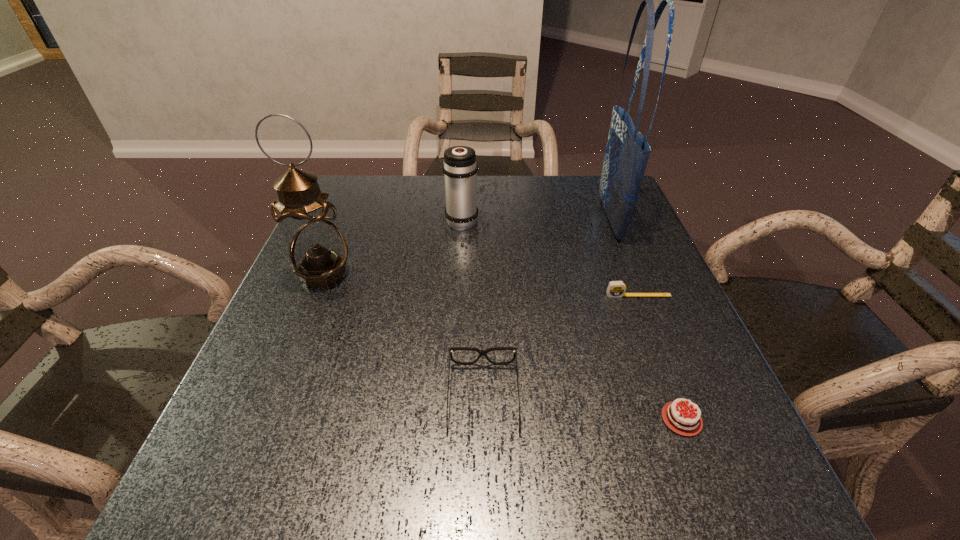
The image size is (960, 540). Identify the location of free space located on the front of the leftmost object. (307, 316).

This screenshot has width=960, height=540. In order to click on blank space located on the side with the handle of the fourth shortest object in this screenshot , I will do `click(465, 179)`.

Find the location of `vacant point located on the side with the handle of the fourth shortest object`. vacant point located on the side with the handle of the fourth shortest object is located at coordinates (464, 194).

Locate an element on the screen. This screenshot has height=540, width=960. free space located at the front of the tape measure with the tape extended is located at coordinates (699, 450).

This screenshot has height=540, width=960. Find the location of `free point located on the back of the chocolate cake`. free point located on the back of the chocolate cake is located at coordinates (630, 282).

Find the location of a particular element. shopping bag at the far edge is located at coordinates (627, 151).

Locate an element on the screen. thermos bottle that is at the far edge is located at coordinates (460, 169).

The height and width of the screenshot is (540, 960). What are the coordinates of `object positioned at the near edge` in the screenshot? It's located at (687, 422).

This screenshot has height=540, width=960. I want to click on object situated at the left edge, so click(x=317, y=250).

At what (x,y) coordinates should I click in order to perform the action: click on shopping bag that is at the right edge. Please return your answer as a coordinate pair (x, y). The width and height of the screenshot is (960, 540). Looking at the image, I should click on (627, 151).